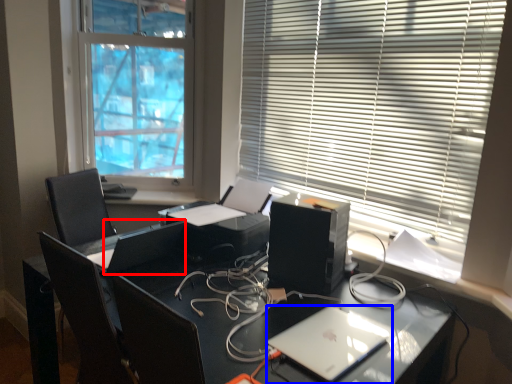
Question: Which point is closer to the camera, computer monitor (highlighted by a red box) or laptop (highlighted by a blue box)?

Choices:
 (A) computer monitor
 (B) laptop

Answer: (B)